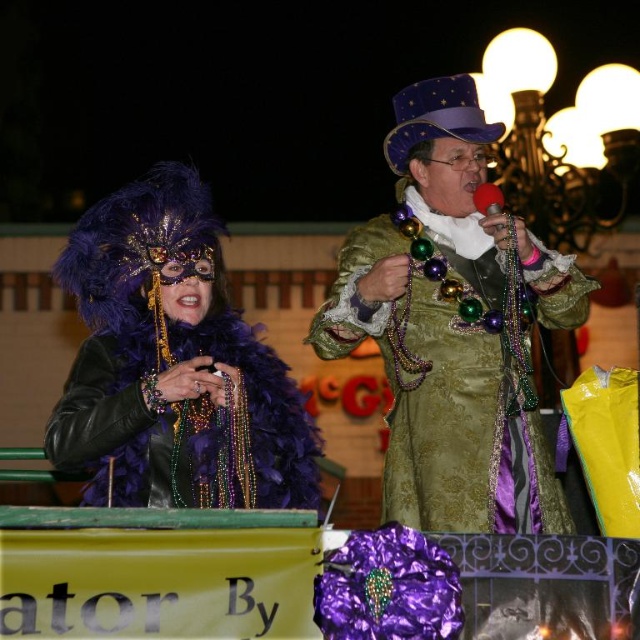
Question: Considering the relative positions of shiny gold coat at center and purple feather boa at center in the image provided, where is shiny gold coat at center located with respect to purple feather boa at center?

Choices:
 (A) right
 (B) left

Answer: (A)

Question: Can you confirm if shiny gold coat at center is positioned to the left of purple feather boa at center?

Choices:
 (A) yes
 (B) no

Answer: (B)

Question: Can you confirm if shiny gold coat at center is bigger than purple feather boa at center?

Choices:
 (A) yes
 (B) no

Answer: (A)

Question: Which object is closer to the camera taking this photo?

Choices:
 (A) purple feather boa at center
 (B) shiny gold coat at center

Answer: (B)

Question: Which point appears farthest from the camera in this image?

Choices:
 (A) (120, 268)
 (B) (387, 518)

Answer: (A)